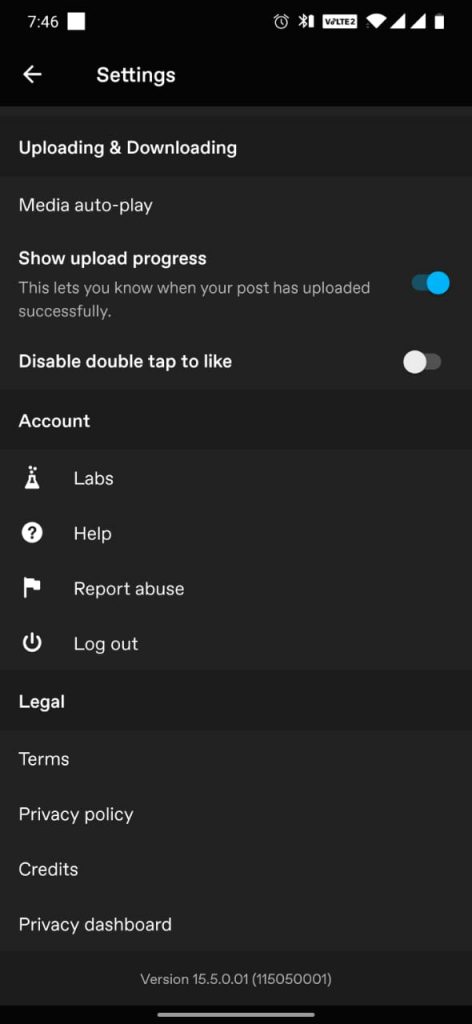
Where is `board`? board is located at coordinates point(140,926), point(161,924).